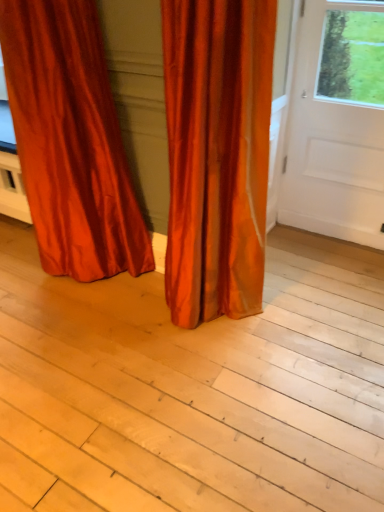
Question: Could you tell me if white smooth door at right is facing light wood plank at center?

Choices:
 (A) no
 (B) yes

Answer: (B)

Question: Is white smooth door at right next to light wood plank at center and touching it?

Choices:
 (A) yes
 (B) no

Answer: (B)

Question: Would you consider white smooth door at right to be distant from light wood plank at center?

Choices:
 (A) no
 (B) yes

Answer: (B)

Question: Does white smooth door at right have a lesser height compared to light wood plank at center?

Choices:
 (A) yes
 (B) no

Answer: (B)

Question: Is the position of white smooth door at right less distant than that of light wood plank at center?

Choices:
 (A) yes
 (B) no

Answer: (B)

Question: Is white smooth door at right at the right side of light wood plank at center?

Choices:
 (A) yes
 (B) no

Answer: (A)

Question: From the image's perspective, does satin orange curtain at center, the first curtain viewed from the right, appear lower than satin orange curtain at lower left, which appears as the 2th curtain when viewed from the right?

Choices:
 (A) no
 (B) yes

Answer: (B)

Question: From a real-world perspective, is satin orange curtain at center, the first curtain viewed from the right, physically below satin orange curtain at lower left, which appears as the 2th curtain when viewed from the right?

Choices:
 (A) yes
 (B) no

Answer: (A)

Question: From the image's perspective, is satin orange curtain at center, the first curtain viewed from the right, above satin orange curtain at lower left, which ranks as the 1th curtain in left-to-right order?

Choices:
 (A) no
 (B) yes

Answer: (A)

Question: Is satin orange curtain at center, the first curtain viewed from the right, behind satin orange curtain at lower left, which appears as the 2th curtain when viewed from the right?

Choices:
 (A) no
 (B) yes

Answer: (A)

Question: Can you confirm if satin orange curtain at center, the first curtain viewed from the right, is thinner than satin orange curtain at lower left, which appears as the 2th curtain when viewed from the right?

Choices:
 (A) no
 (B) yes

Answer: (B)

Question: Is satin orange curtain at center, which is the 2th curtain from left to right, shorter than satin orange curtain at lower left, which ranks as the 1th curtain in left-to-right order?

Choices:
 (A) yes
 (B) no

Answer: (B)

Question: Considering the relative sizes of satin orange curtain at lower left, which ranks as the 1th curtain in left-to-right order, and light wood plank at center in the image provided, is satin orange curtain at lower left, which ranks as the 1th curtain in left-to-right order, smaller than light wood plank at center?

Choices:
 (A) yes
 (B) no

Answer: (B)